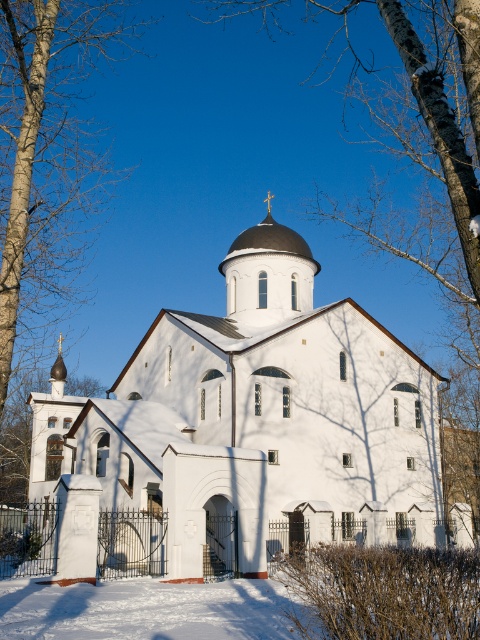
Question: Is white smooth church at center positioned behind bare wood tree at left?

Choices:
 (A) yes
 (B) no

Answer: (A)

Question: Among these points, which one is nearest to the camera?

Choices:
 (A) (160, 499)
 (B) (36, 248)

Answer: (A)

Question: Which object is farther from the camera taking this photo?

Choices:
 (A) bare wood tree at left
 (B) white smooth church at center

Answer: (B)

Question: Is white smooth church at center to the left of bare wood tree at left from the viewer's perspective?

Choices:
 (A) no
 (B) yes

Answer: (A)

Question: Is white smooth church at center thinner than bare wood tree at left?

Choices:
 (A) no
 (B) yes

Answer: (A)